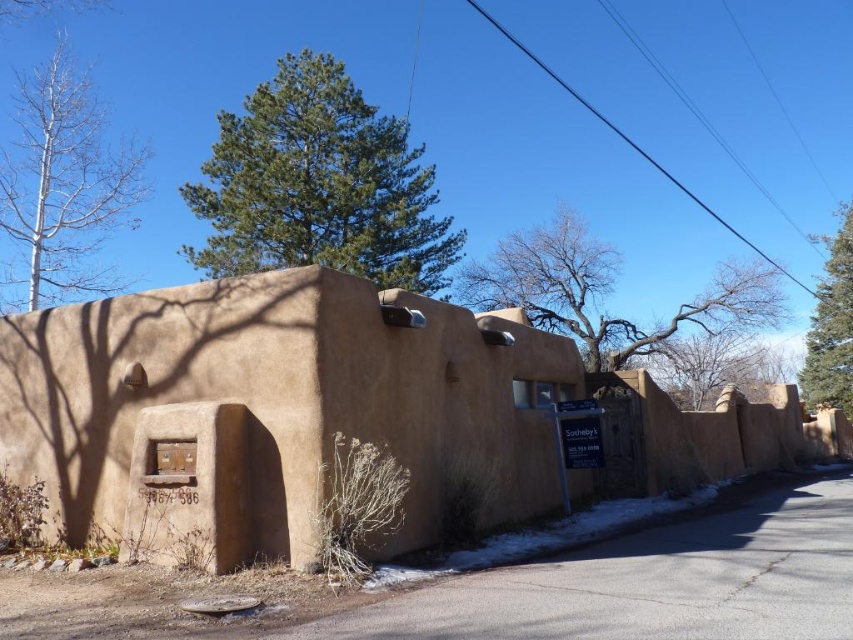
Is white smooth tree at left further to camera compared to bare branches at upper center?

No, white smooth tree at left is closer to the viewer.

Which of these two, white smooth tree at left or bare branches at upper center, stands taller?

bare branches at upper center is taller.

Does point (28, 102) come farther from viewer compared to point (567, 288)?

No, (28, 102) is closer to viewer.

What are the coordinates of `white smooth tree at left` in the screenshot? It's located at (61, 186).

Which is below, adobe wall at center or green coniferous tree at upper center?

adobe wall at center is below.

Locate an element on the screen. adobe wall at center is located at coordinates (276, 412).

Who is more forward, (84,106) or (834,392)?

Point (84,106) is more forward.

Is point (32, 128) closer to camera compared to point (798, 378)?

Yes.

The height and width of the screenshot is (640, 853). In order to click on white smooth tree at left in this screenshot , I will do `click(61, 186)`.